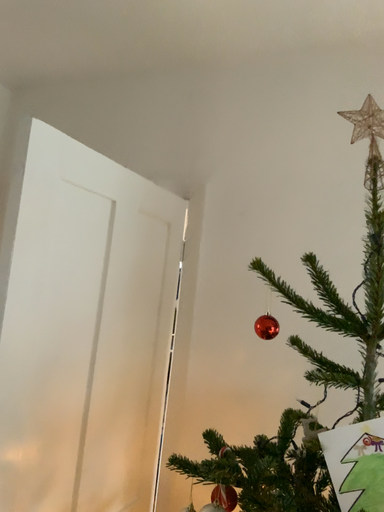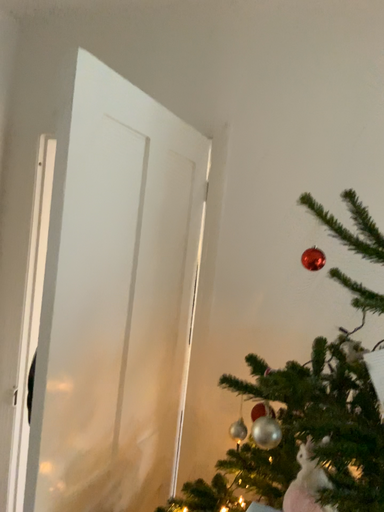
Question: How did the camera likely rotate when shooting the video?

Choices:
 (A) rotated downward
 (B) rotated upward

Answer: (A)